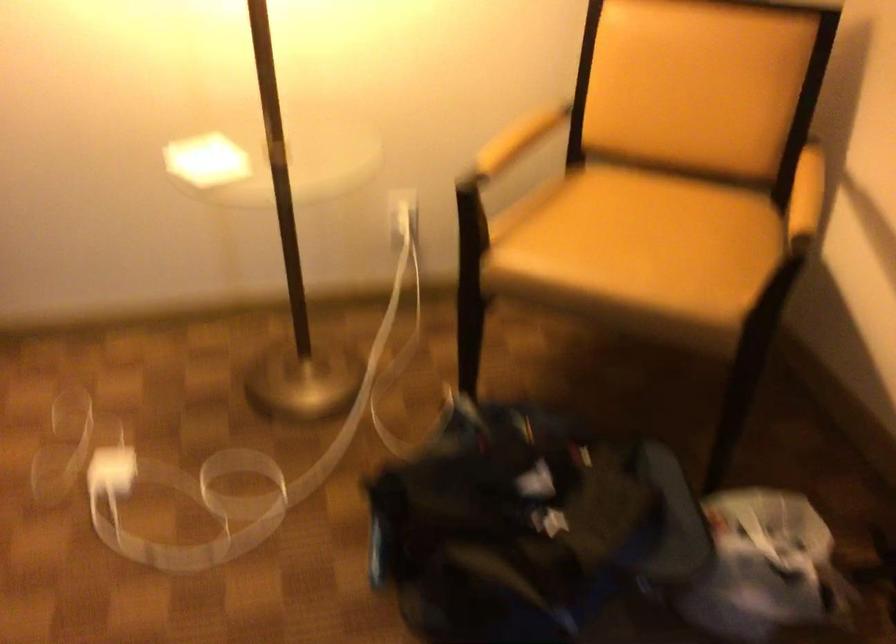
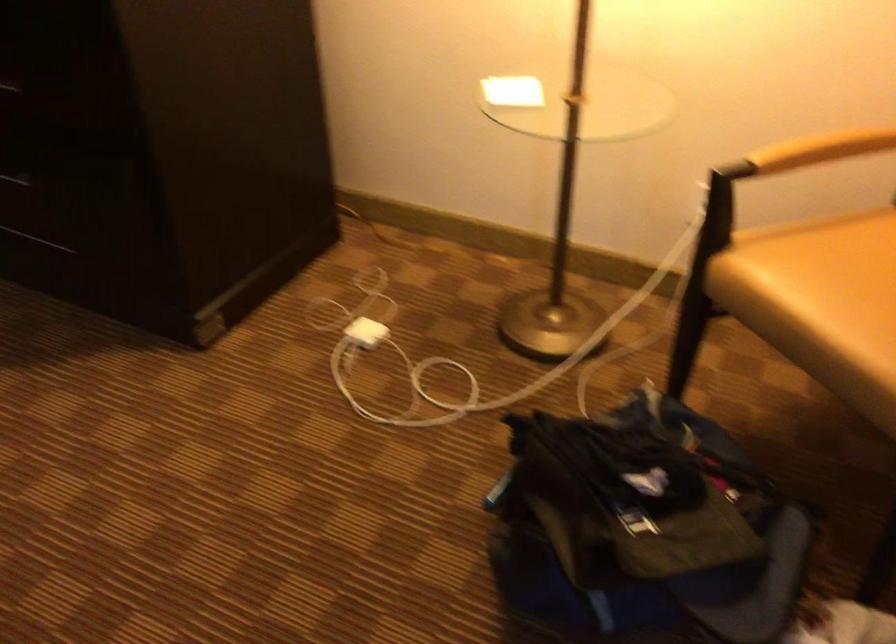
Question: The camera is either moving clockwise (left) or counter-clockwise (right) around the object. The first image is from the beginning of the video and the second image is from the end. Is the camera moving left or right when shooting the video?

Choices:
 (A) Left
 (B) Right

Answer: (B)